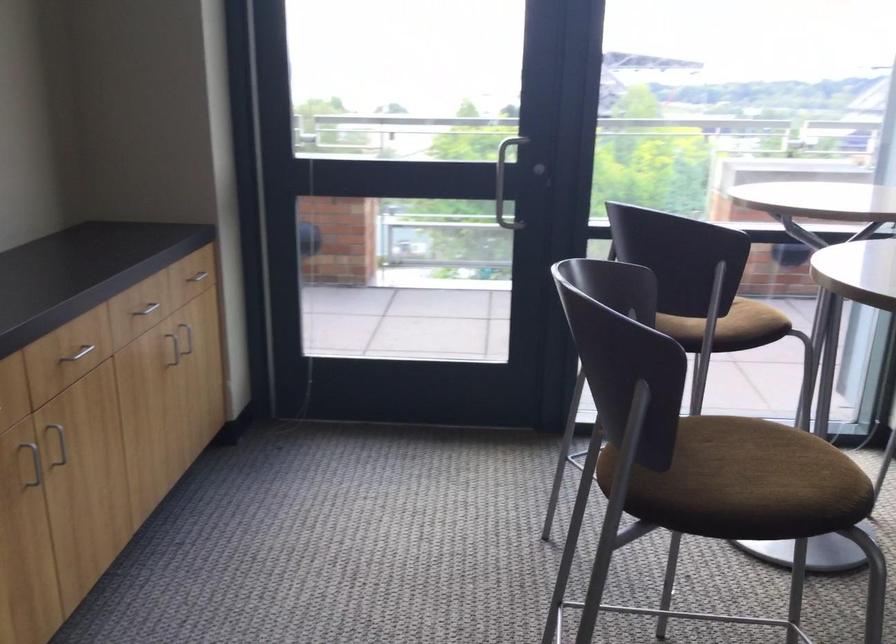
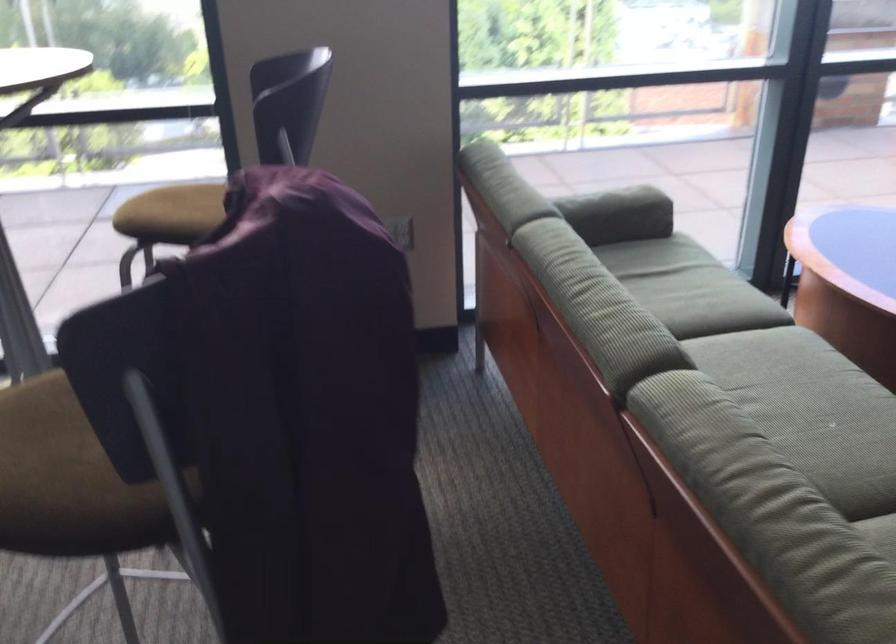
Question: The images are taken continuously from a first-person perspective. In which direction are you moving?

Choices:
 (A) Left
 (B) Right
 (C) Forward
 (D) Backward

Answer: (B)